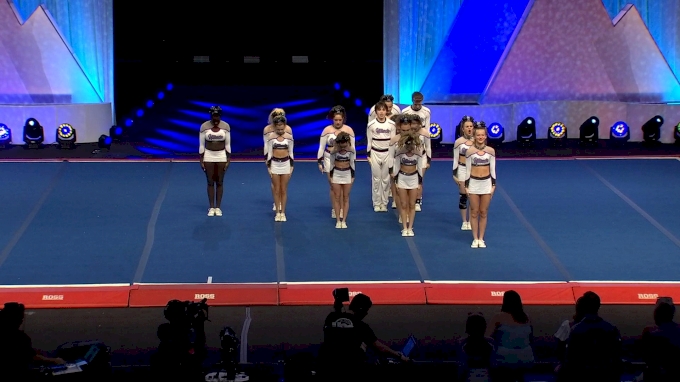
Where is `wall`? wall is located at coordinates (52, 51), (573, 76).